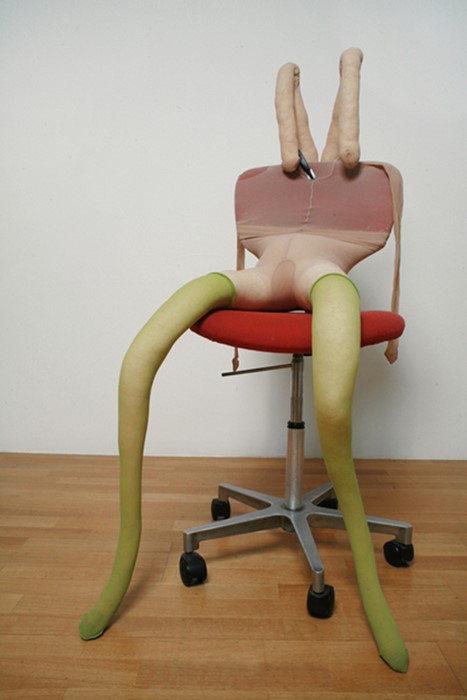
Locate an element on the screen. Image resolution: width=467 pixels, height=700 pixels. empty space on the wall is located at coordinates coord(204,148).